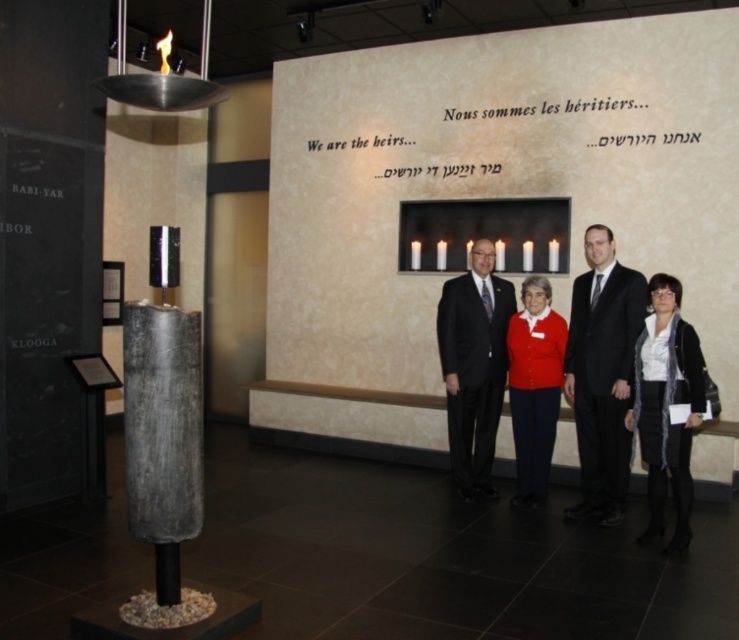
Question: Is matte black suit at center thinner than black textured scarf at lower right?

Choices:
 (A) no
 (B) yes

Answer: (A)

Question: Does black suit at center appear on the left side of matte black suit at center?

Choices:
 (A) yes
 (B) no

Answer: (B)

Question: Which point is closer to the camera?

Choices:
 (A) (531, 384)
 (B) (568, 358)

Answer: (B)

Question: Which object appears farthest from the camera in this image?

Choices:
 (A) black textured scarf at lower right
 (B) matte black suit at center
 (C) matte red sweater at center

Answer: (B)

Question: Can you confirm if matte black suit at center is thinner than matte red sweater at center?

Choices:
 (A) yes
 (B) no

Answer: (B)

Question: Which of the following is the closest to the observer?

Choices:
 (A) matte red sweater at center
 (B) black textured scarf at lower right
 (C) matte black suit at center
 (D) black suit at center

Answer: (B)